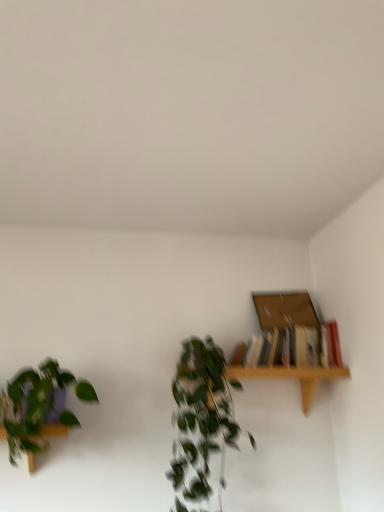
Question: In terms of size, does green leafy plant at center, marked as the 1th houseplant in a right-to-left arrangement, appear bigger or smaller than brown cardboard box at upper right?

Choices:
 (A) small
 (B) big

Answer: (B)

Question: Choose the correct answer: Is green leafy plant at center, marked as the 1th houseplant in a right-to-left arrangement, inside brown cardboard box at upper right or outside it?

Choices:
 (A) inside
 (B) outside

Answer: (B)

Question: Based on their relative distances, which object is nearer to the hardcover books at upper right?

Choices:
 (A) brown cardboard box at upper right
 (B) green leafy plant at center, marked as the 1th houseplant in a right-to-left arrangement
 (C) light wood shelf at upper right
 (D) green matte plant at left, the first houseplant positioned from the left

Answer: (C)

Question: Considering the real-world distances, which object is closest to the hardcover books at upper right?

Choices:
 (A) brown cardboard box at upper right
 (B) green matte plant at left, the second houseplant from the right
 (C) green leafy plant at center, marked as the 1th houseplant in a right-to-left arrangement
 (D) light wood shelf at upper right

Answer: (D)